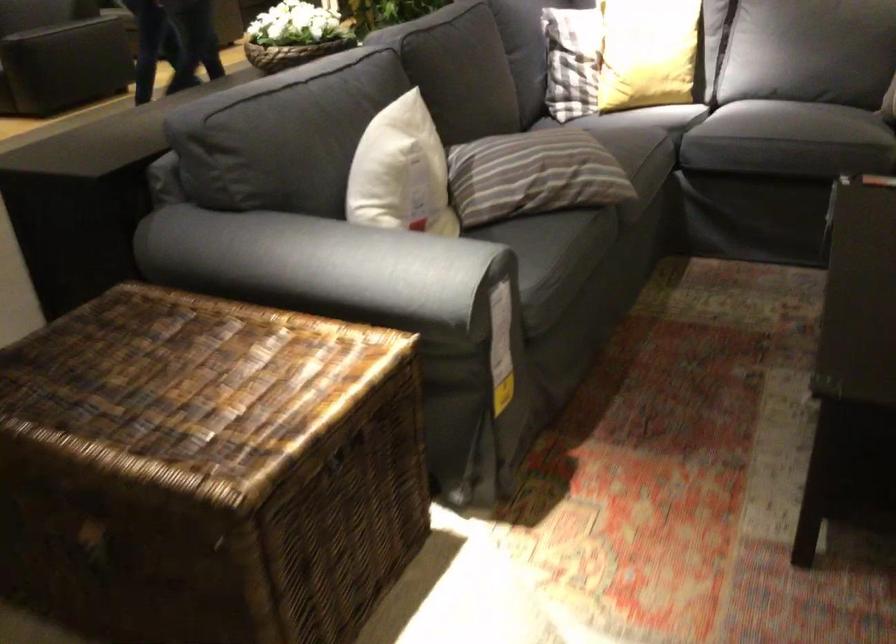
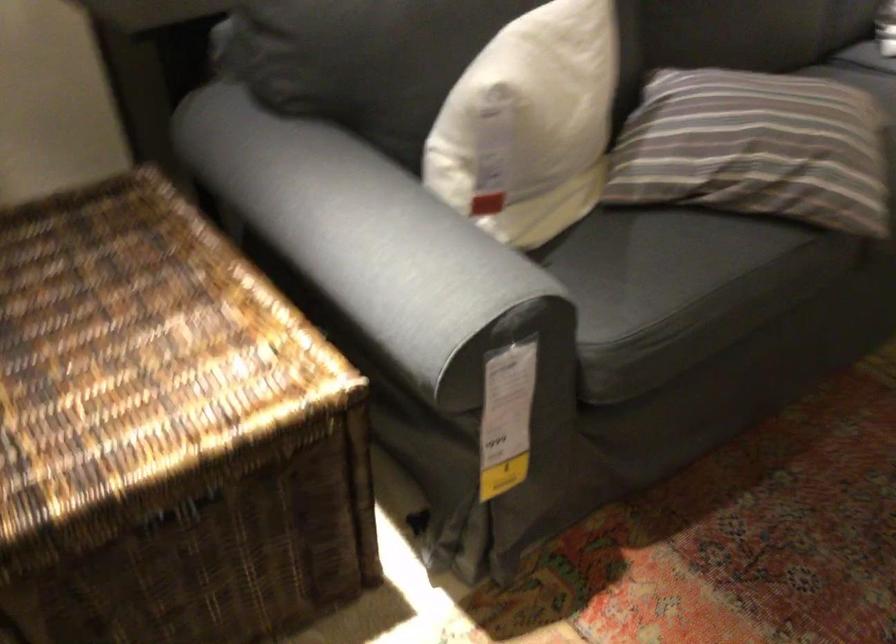
Question: The camera is either moving clockwise (left) or counter-clockwise (right) around the object. The first image is from the beginning of the video and the second image is from the end. Is the camera moving left or right when shooting the video?

Choices:
 (A) Left
 (B) Right

Answer: (B)